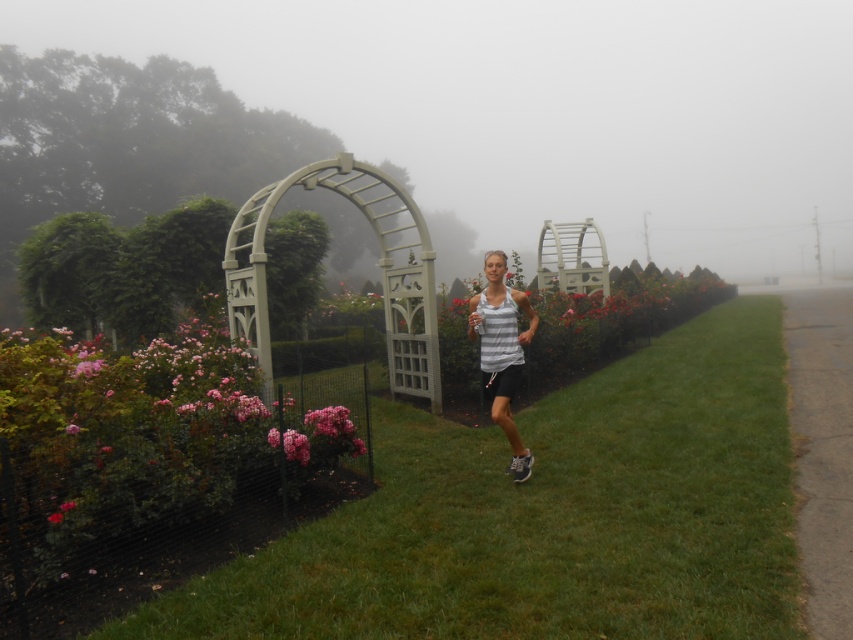
Question: Does pink matte flowers at center come behind pink matte flower at center-left?

Choices:
 (A) yes
 (B) no

Answer: (A)

Question: Which is nearer to the white striped tank top at center?

Choices:
 (A) pink matte flowers at center
 (B) gray asphalt at lower right

Answer: (A)

Question: Which object is farther from the camera taking this photo?

Choices:
 (A) white striped tank top at center
 (B) green leafy hedge at left

Answer: (B)

Question: Does green grass at center have a lesser width compared to pink matte flower at center?

Choices:
 (A) yes
 (B) no

Answer: (B)

Question: Which point appears farthest from the camera in this image?

Choices:
 (A) (49, 522)
 (B) (782, 292)
 (C) (305, 561)
 (D) (341, 424)

Answer: (B)

Question: Is the position of pink matte flower at center-left more distant than that of pink matte flower at center?

Choices:
 (A) no
 (B) yes

Answer: (B)